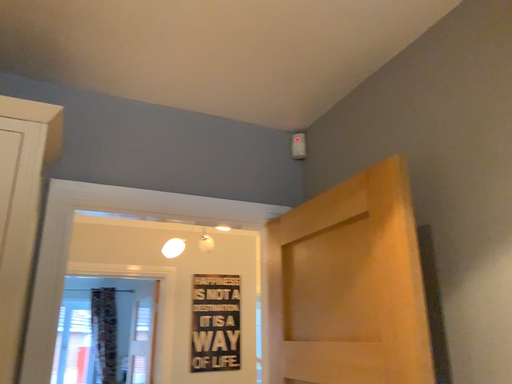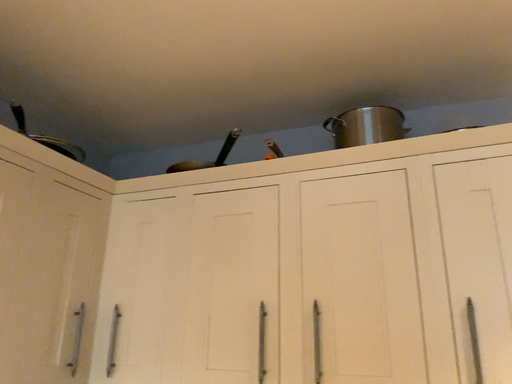
Question: How did the camera likely rotate when shooting the video?

Choices:
 (A) rotated right
 (B) rotated left

Answer: (B)